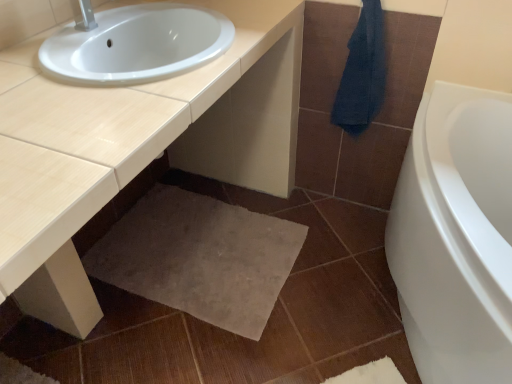
Find the location of a particular element. free point above beige carpet at lower center (from a real-world perspective) is located at coordinates pos(192,247).